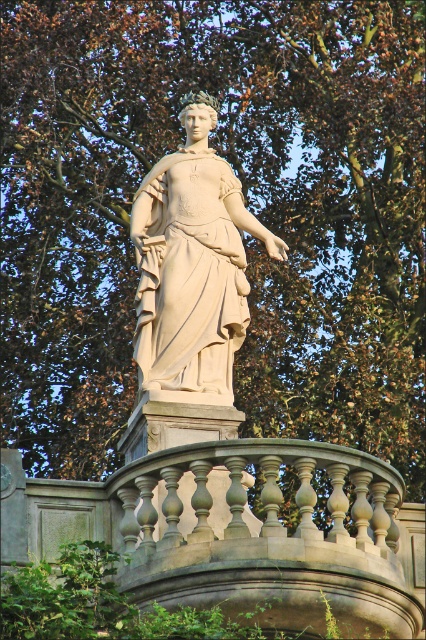
You are an architect inspecting the statue and its pedestal. You notice the gray stone balustrade at center and the beige stone statue at center. Which object has a bigger size?

The gray stone balustrade at center has a larger size compared to the beige stone statue at center.

You are a maintenance worker needing to clean the beige stone statue at center. You have a ladder that is 8 meters long. The gray stone balustrade at center is in the way. Can you safely reach the statue without moving the balustrade?

The gray stone balustrade at center is 8.32 meters from the beige stone statue at center. Since the ladder is only 8 meters long, it is shorter than the distance between them. Therefore, you cannot safely reach the statue without moving the balustrade.

You are an art conservator assessing the placement of the beige stone statue at center and the gray stone balustrade at center in the image. Which object is positioned lower in the scene?

The gray stone balustrade at center is below the beige stone statue at center, so it is positioned lower in the scene.